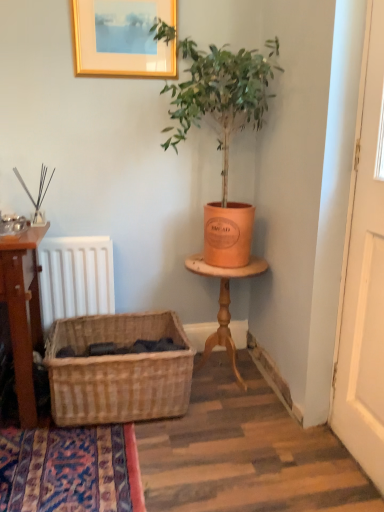
The image size is (384, 512). I want to click on vacant space in front of woven natural basket at lower left, so click(x=120, y=463).